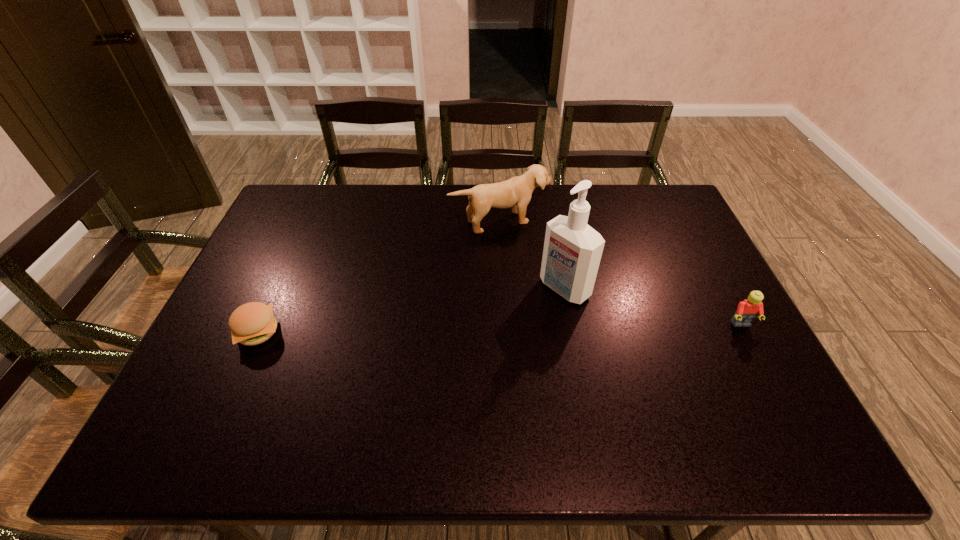
The image size is (960, 540). I want to click on the leftmost object, so (253, 323).

Identify the location of the shortest object. pyautogui.click(x=253, y=323).

The height and width of the screenshot is (540, 960). In order to click on Lego in this screenshot , I will do `click(747, 310)`.

The height and width of the screenshot is (540, 960). I want to click on the rightmost object, so click(x=747, y=310).

Find the location of a particular element. puppy is located at coordinates (516, 192).

What are the coordinates of `the farthest object` in the screenshot? It's located at [516, 192].

Locate an element on the screen. Image resolution: width=960 pixels, height=540 pixels. the second farthest object is located at coordinates (572, 251).

In order to click on the tallest object in this screenshot , I will do `click(572, 251)`.

Identify the location of free space located on the front of the shortest object. The height and width of the screenshot is (540, 960). (231, 392).

At what (x,y) coordinates should I click in order to perform the action: click on free region located on the face of the rightmost object. Please return your answer as a coordinate pair (x, y). Image resolution: width=960 pixels, height=540 pixels. Looking at the image, I should click on (757, 356).